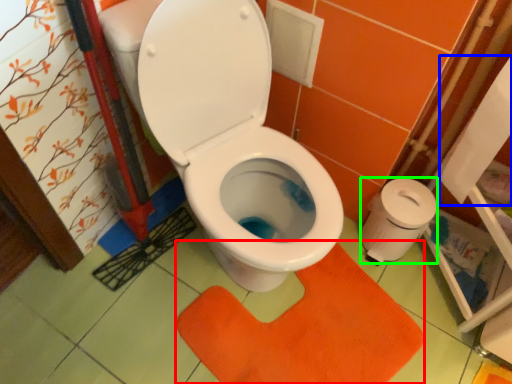
Question: Estimate the real-world distances between objects in this image. Which object is closer to doormat (highlighted by a red box), toilet paper (highlighted by a blue box) or toilet paper (highlighted by a green box)?

Choices:
 (A) toilet paper
 (B) toilet paper

Answer: (B)